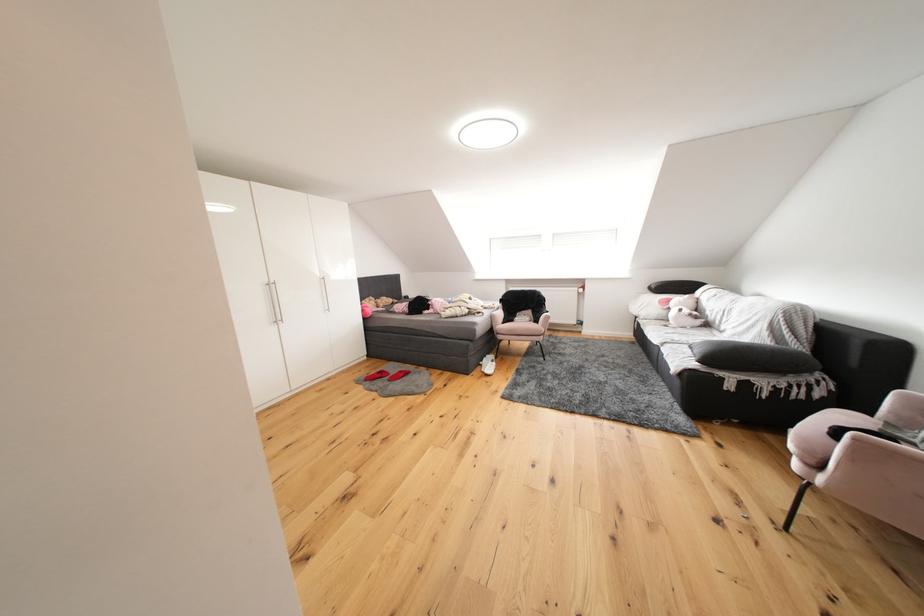
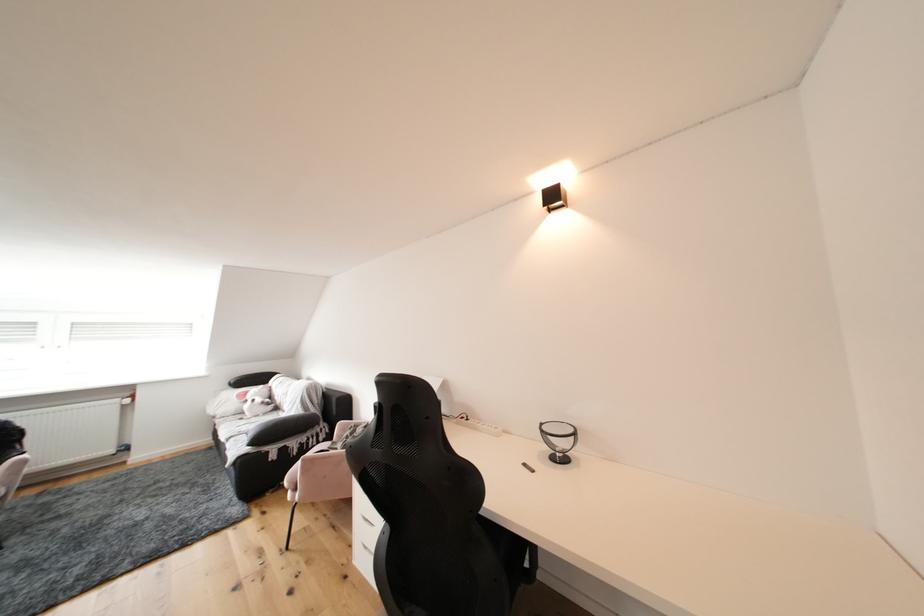
Locate, in the second image, the point that corresponds to (x=724, y=336) in the first image.

(290, 416)